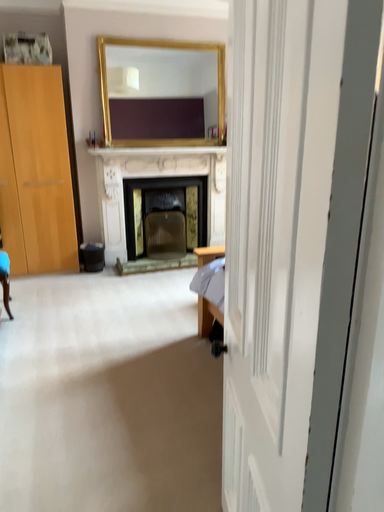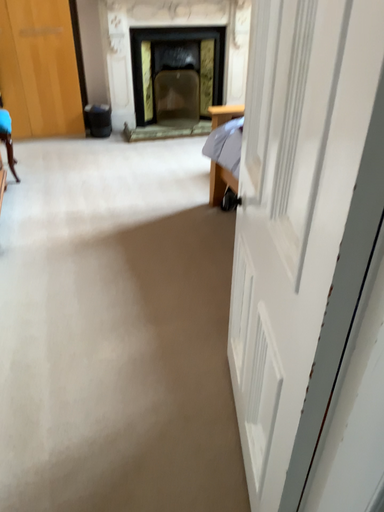
Question: How did the camera likely rotate when shooting the video?

Choices:
 (A) rotated downward
 (B) rotated upward

Answer: (A)